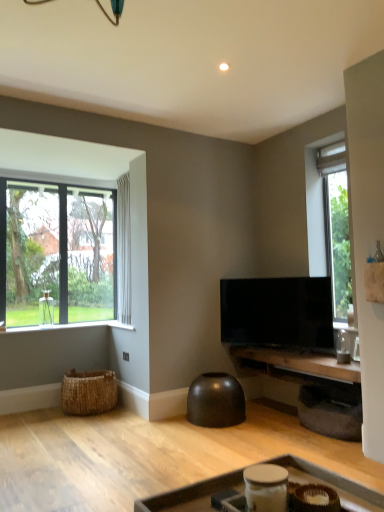
Question: Relative to white wood window sill at lower left, is wooden tray at lower center, marked as the 1th table in a front-to-back arrangement, in front or behind?

Choices:
 (A) behind
 (B) front

Answer: (B)

Question: Looking at their shapes, would you say wooden tray at lower center, marked as the 1th table in a front-to-back arrangement, is wider or thinner than white wood window sill at lower left?

Choices:
 (A) thin
 (B) wide

Answer: (B)

Question: Based on their relative distances, which object is farther from the white wood window sill at lower left?

Choices:
 (A) wooden table at center, which is the 2th table from front to back
 (B) white sheer curtain at left
 (C) flat screen tv at center
 (D) clear glass window at left
 (E) wooden tray at lower center, which is the 2th table in back-to-front order

Answer: (E)

Question: Based on their relative distances, which object is farther from the wooden tray at lower center, which is the 2th table in back-to-front order?

Choices:
 (A) white sheer curtain at left
 (B) white wood window sill at lower left
 (C) wooden table at center, which is the 2th table from front to back
 (D) flat screen tv at center
 (E) woven brown basket at lower left

Answer: (A)